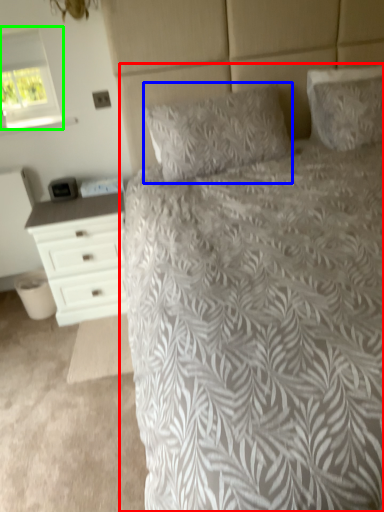
Question: Estimate the real-world distances between objects in this image. Which object is farther from bed (highlighted by a red box), pillow (highlighted by a blue box) or window (highlighted by a green box)?

Choices:
 (A) pillow
 (B) window

Answer: (B)